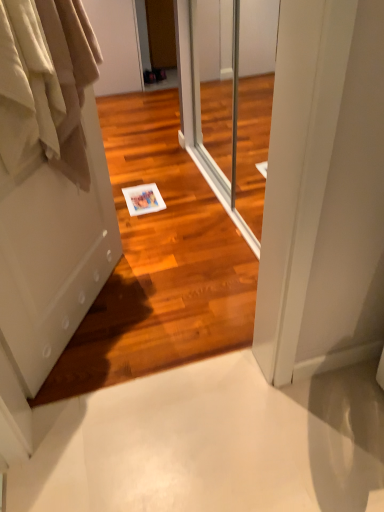
Question: Should I look upward or downward to see beige cotton curtains at left?

Choices:
 (A) up
 (B) down

Answer: (A)

Question: From the image's perspective, does beige cotton curtains at left appear higher than white matte door at left?

Choices:
 (A) no
 (B) yes

Answer: (B)

Question: Is beige cotton curtains at left outside of white matte door at left?

Choices:
 (A) yes
 (B) no

Answer: (A)

Question: From a real-world perspective, is beige cotton curtains at left physically below white matte door at left?

Choices:
 (A) yes
 (B) no

Answer: (B)

Question: Is beige cotton curtains at left wider than white matte door at left?

Choices:
 (A) yes
 (B) no

Answer: (A)

Question: Considering the relative sizes of beige cotton curtains at left and white matte door at left in the image provided, is beige cotton curtains at left bigger than white matte door at left?

Choices:
 (A) no
 (B) yes

Answer: (A)

Question: Is beige cotton curtains at left smaller than white matte door at left?

Choices:
 (A) no
 (B) yes

Answer: (B)

Question: Is white matte door at left not inside transparent glass screen door at center?

Choices:
 (A) no
 (B) yes

Answer: (B)

Question: Is white matte door at left with transparent glass screen door at center?

Choices:
 (A) yes
 (B) no

Answer: (B)

Question: From the image's perspective, is white matte door at left below transparent glass screen door at center?

Choices:
 (A) yes
 (B) no

Answer: (A)

Question: Could you tell me if white matte door at left is facing transparent glass screen door at center?

Choices:
 (A) yes
 (B) no

Answer: (B)

Question: Can you confirm if white matte door at left is thinner than transparent glass screen door at center?

Choices:
 (A) no
 (B) yes

Answer: (B)

Question: Could transparent glass screen door at center be considered to be inside white matte door at left?

Choices:
 (A) yes
 (B) no

Answer: (B)

Question: Does beige cotton curtains at left have a greater width compared to transparent glass screen door at center?

Choices:
 (A) no
 (B) yes

Answer: (B)